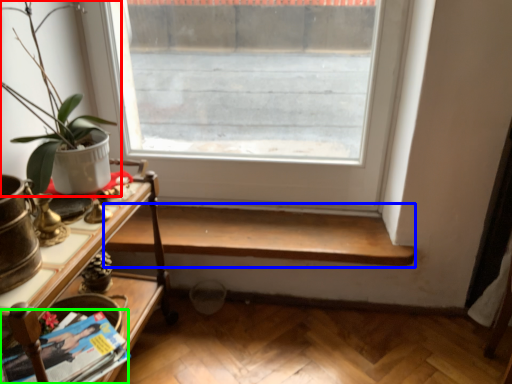
Question: Considering the real-world distances, which object is farthest from houseplant (highlighted by a red box)? shelf (highlighted by a blue box) or magazine (highlighted by a green box)?

Choices:
 (A) shelf
 (B) magazine

Answer: (A)